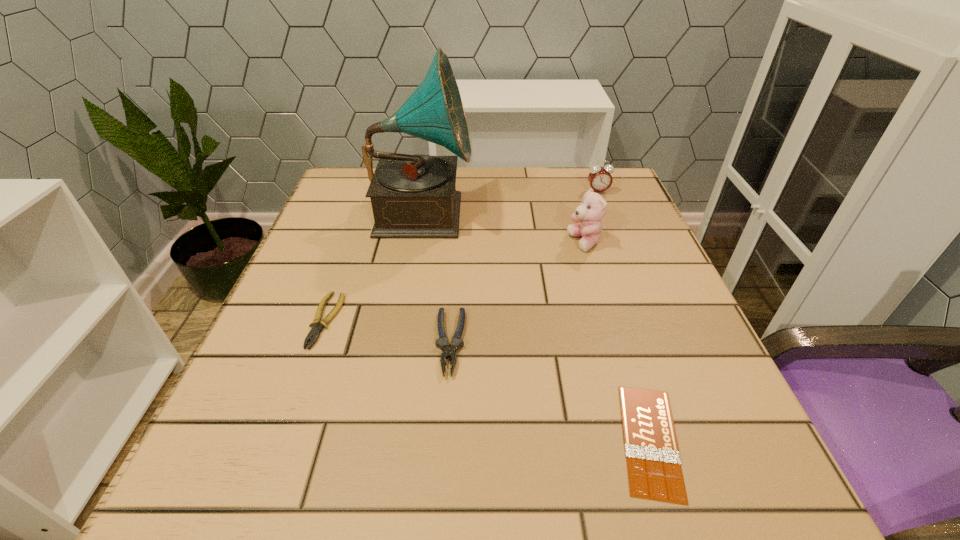
The height and width of the screenshot is (540, 960). Identify the location of the tallest object. pyautogui.click(x=413, y=196).

Find the location of `the second tallest object`. the second tallest object is located at coordinates (591, 211).

Identify the location of the fourth shortest object. The width and height of the screenshot is (960, 540). (600, 179).

The width and height of the screenshot is (960, 540). What are the coordinates of `the right pliers` in the screenshot? It's located at (448, 351).

Identify the location of the taller pliers. (448, 351).

Identify the location of the shorter pliers. Image resolution: width=960 pixels, height=540 pixels. (317, 325).

Identify the location of the left pliers. Image resolution: width=960 pixels, height=540 pixels. (317, 325).

The image size is (960, 540). Find the location of `chocolate bar`. chocolate bar is located at coordinates (654, 469).

The width and height of the screenshot is (960, 540). What are the coordinates of `the nearest object` in the screenshot? It's located at (654, 469).

Image resolution: width=960 pixels, height=540 pixels. Identify the location of free point located 0.370m on the horn of the record player. (629, 212).